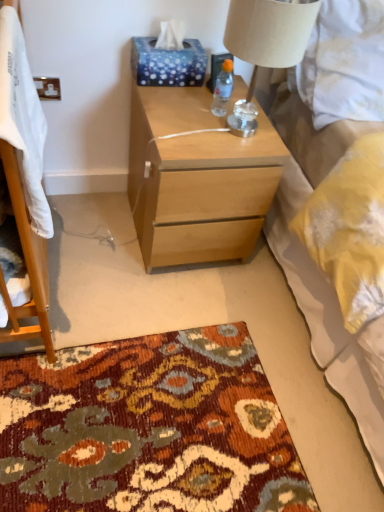
Locate an element on the screen. vacant space to the left of light wood/finish nightstand at center is located at coordinates (95, 227).